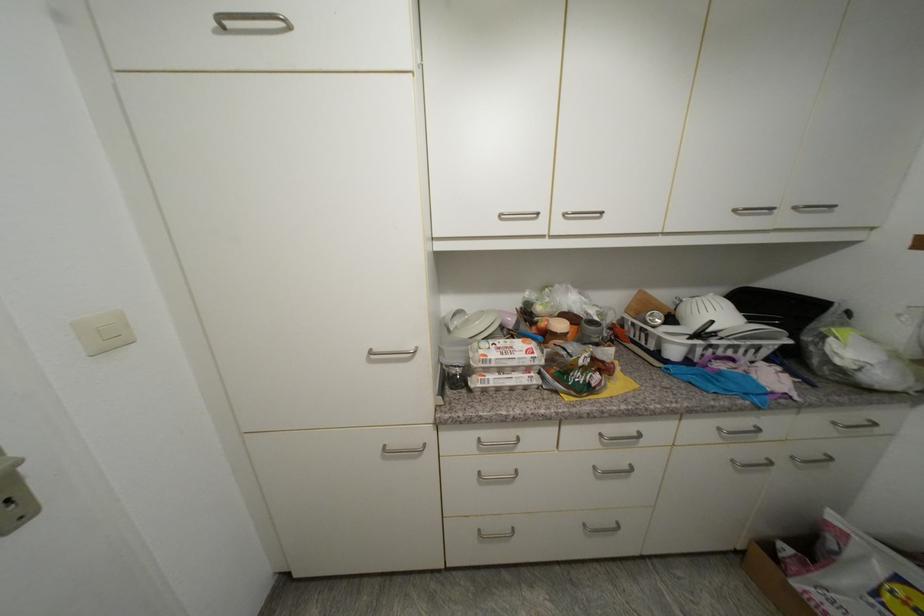
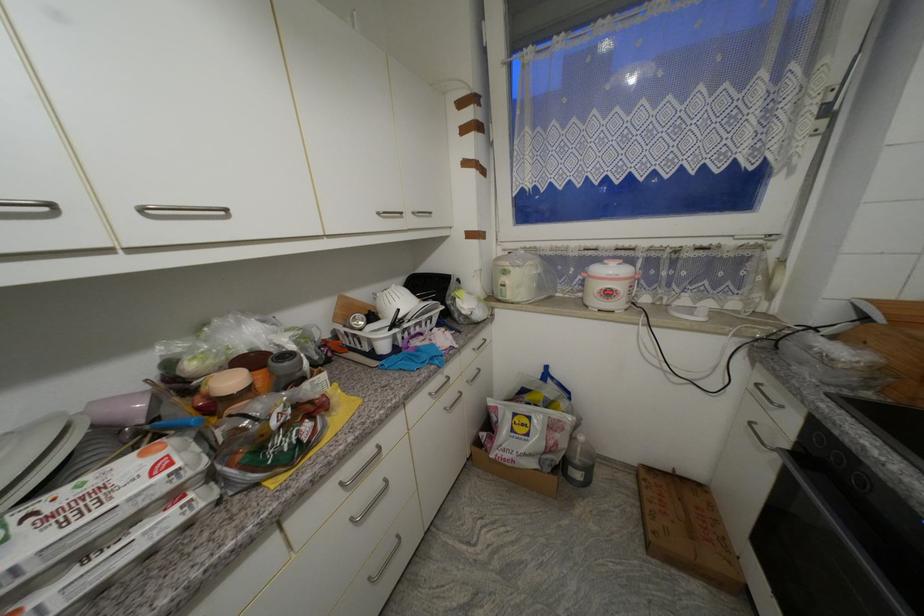
Where in the second image is the point corresponding to the point at 570,216 from the first image?

(149, 211)